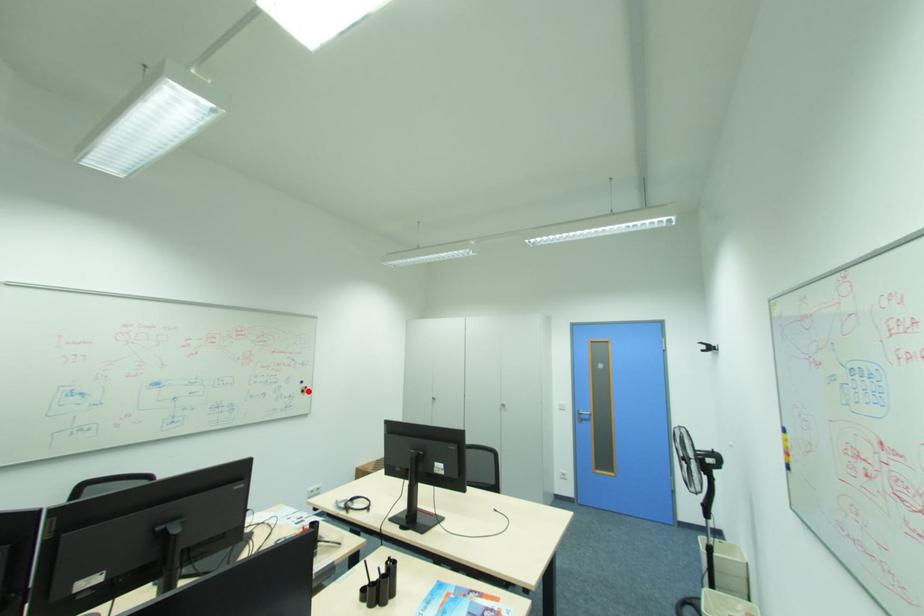
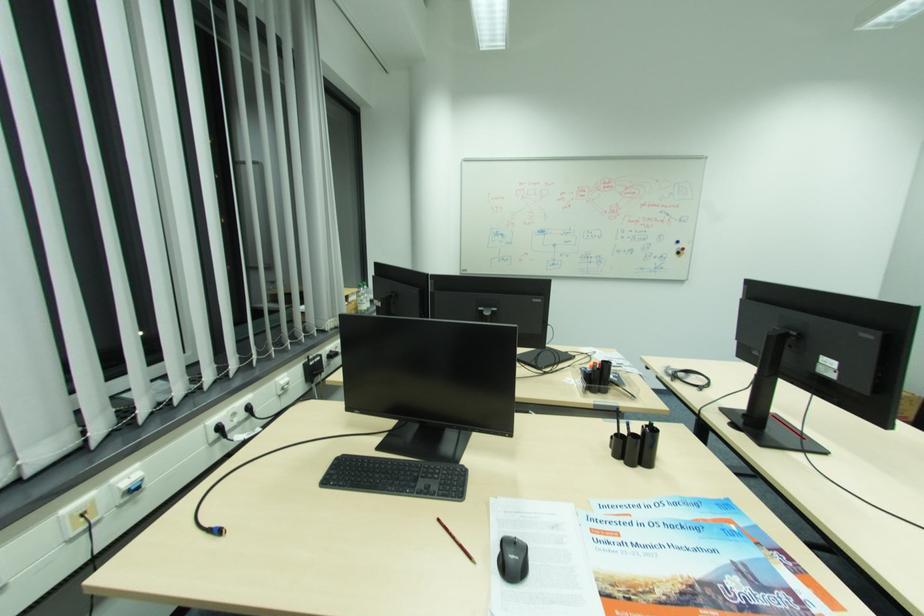
Question: I am providing you with two images of the same scene from different viewpoints. Given a red point in image1, look at the same physical point in image2. Is it:

Choices:
 (A) Closer to the viewpoint
 (B) Farther from the viewpoint

Answer: (A)